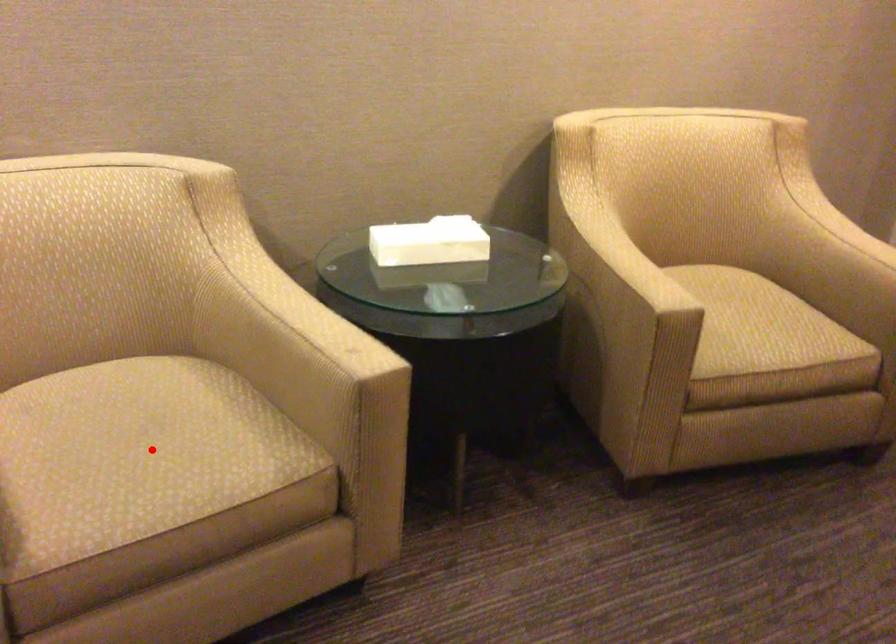
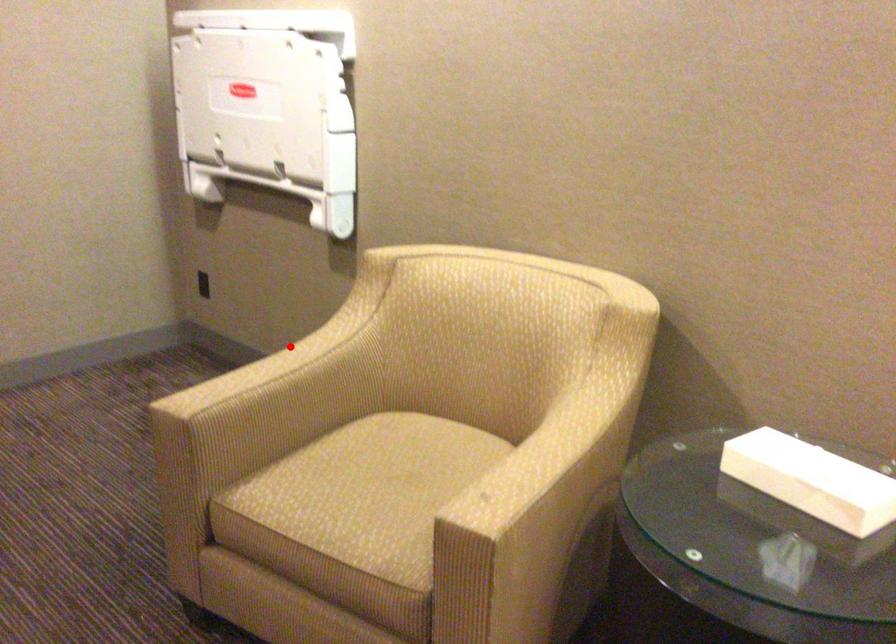
I am providing you with two images of the same scene from different viewpoints. A red point is marked on the first image and another point is marked on the second image. Does the point marked in image1 correspond to the same location as the one in image2?

No